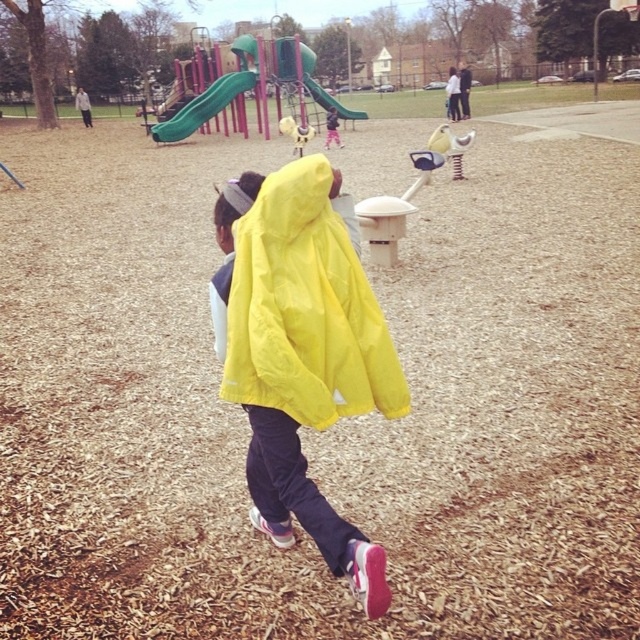
Question: Which is farther from the green plastic slide at upper center?

Choices:
 (A) green rubber slide at upper center
 (B) yellow matte jacket at center

Answer: (B)

Question: Which object appears farthest from the camera in this image?

Choices:
 (A) yellow matte jacket at center
 (B) green plastic slide at upper center

Answer: (B)

Question: Considering the relative positions of yellow matte jacket at center and green plastic slide at upper center in the image provided, where is yellow matte jacket at center located with respect to green plastic slide at upper center?

Choices:
 (A) left
 (B) right

Answer: (B)

Question: Does green plastic slide at upper center appear under green rubber slide at upper center?

Choices:
 (A) yes
 (B) no

Answer: (A)

Question: Among these objects, which one is farthest from the camera?

Choices:
 (A) yellow matte jacket at center
 (B) green rubber slide at upper center

Answer: (B)

Question: Does yellow matte jacket at center appear on the left side of green rubber slide at upper center?

Choices:
 (A) yes
 (B) no

Answer: (B)